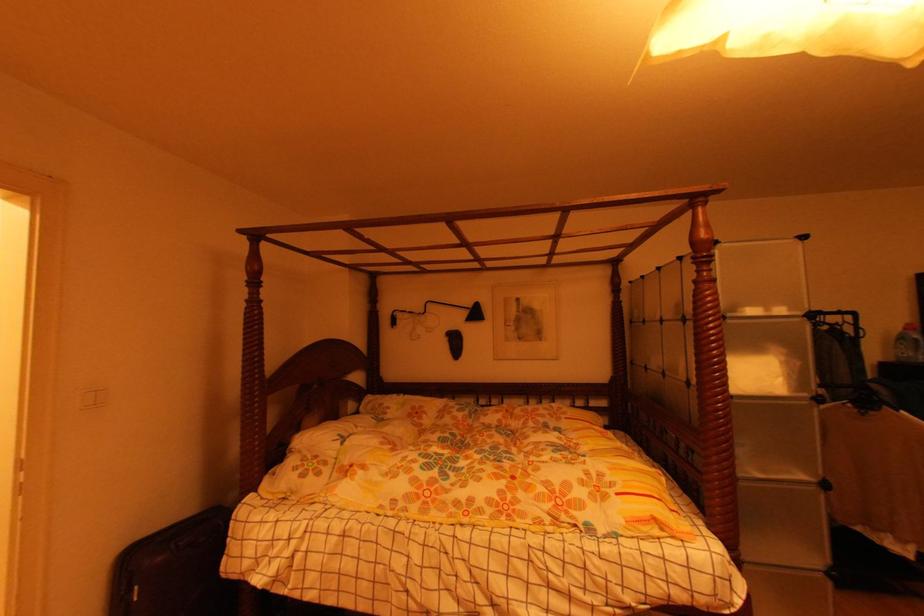
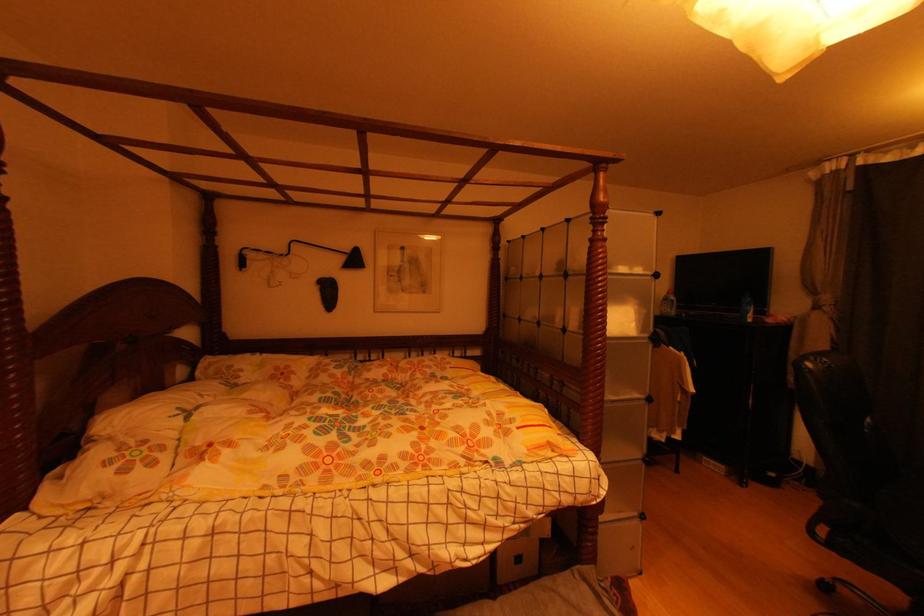
Where in the second image is the point corresponding to pixel 469 314 from the first image?

(346, 261)